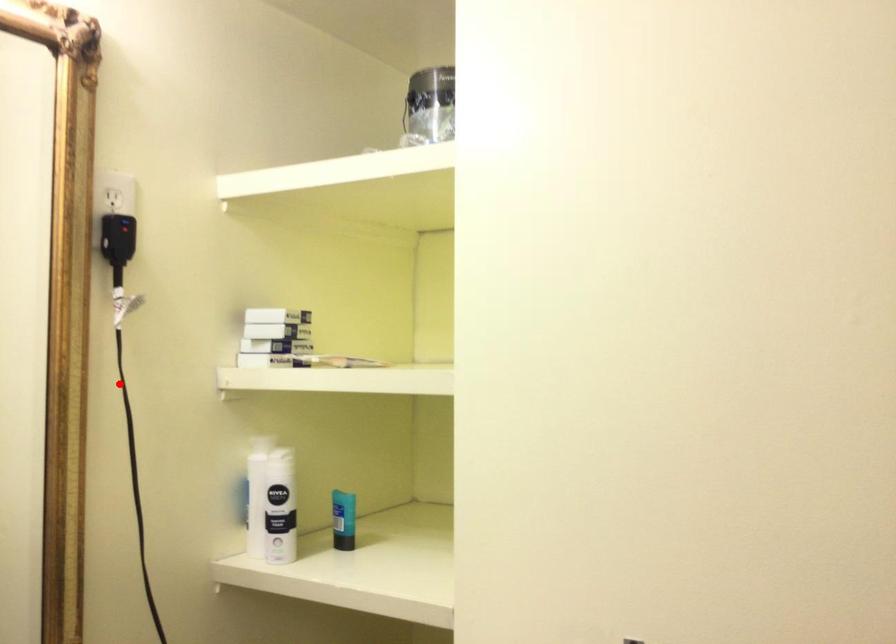
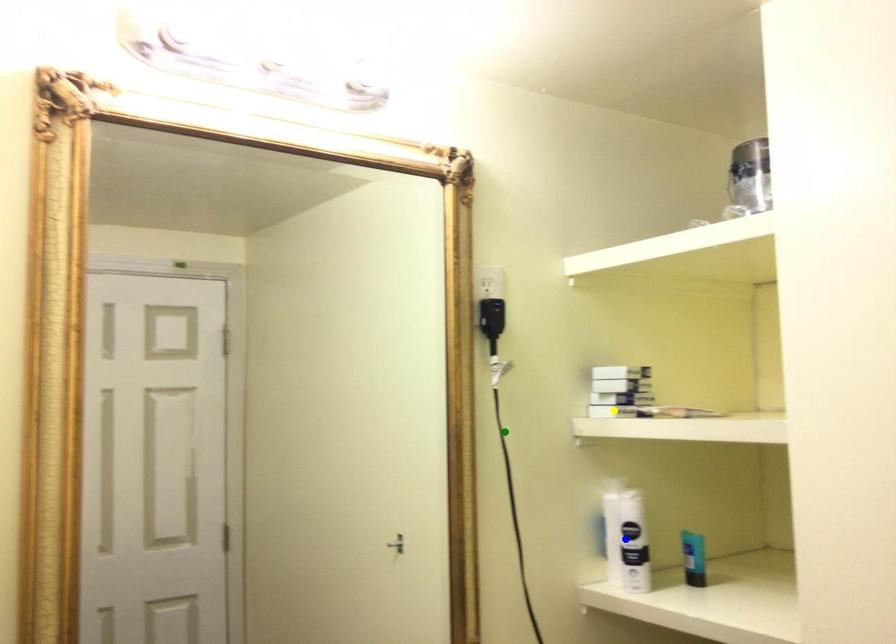
Question: I am providing you with two images of the same scene from different viewpoints. A red point is marked on the first image. You are given multiple points on the second image. Which point in image 2 represents the same 3d spot as the red point in image 1?

Choices:
 (A) green point
 (B) blue point
 (C) yellow point

Answer: (A)